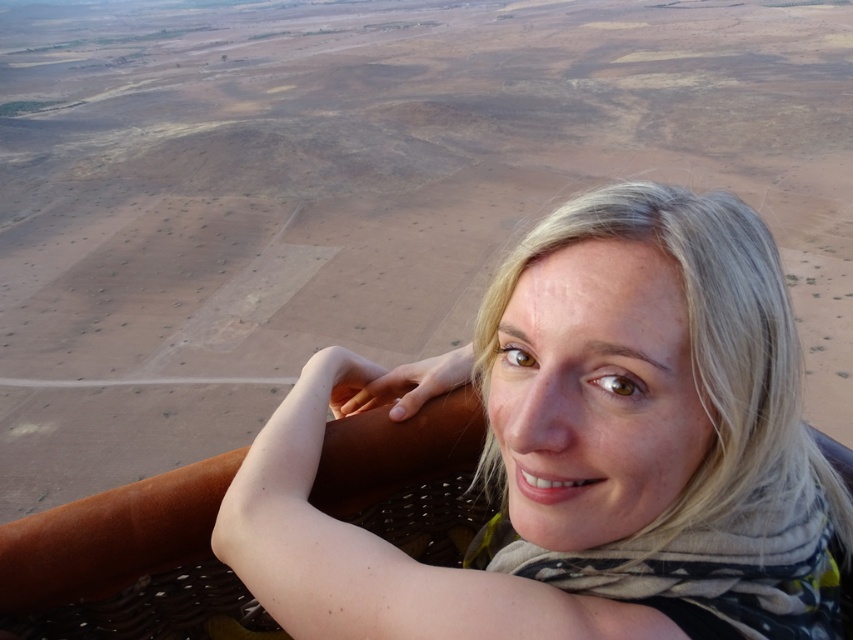
Does blonde hair at center appear under printed cotton scarf at lower right?

No, blonde hair at center is not below printed cotton scarf at lower right.

Locate an element on the screen. The width and height of the screenshot is (853, 640). blonde hair at center is located at coordinates (581, 449).

Between point (534, 524) and point (770, 509), which one is positioned in front?

Positioned in front is point (534, 524).

Where is `blonde hair at center`? This screenshot has width=853, height=640. blonde hair at center is located at coordinates (581, 449).